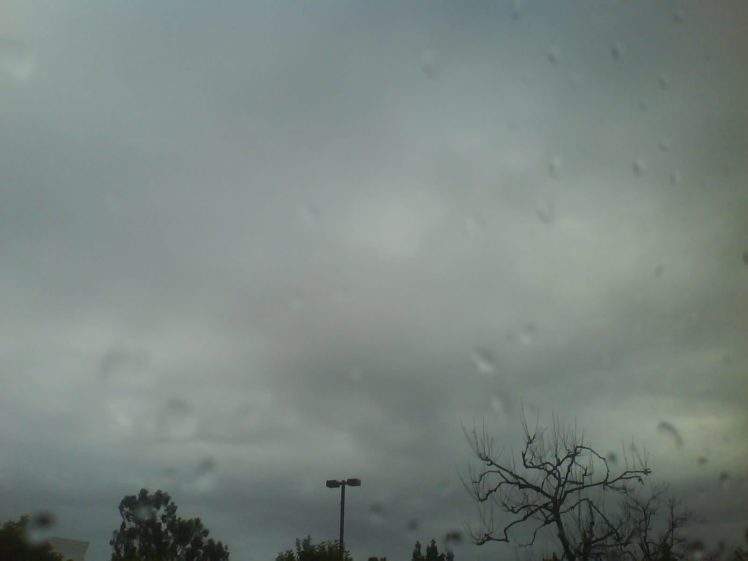
The height and width of the screenshot is (561, 748). I want to click on light, so click(x=357, y=481).